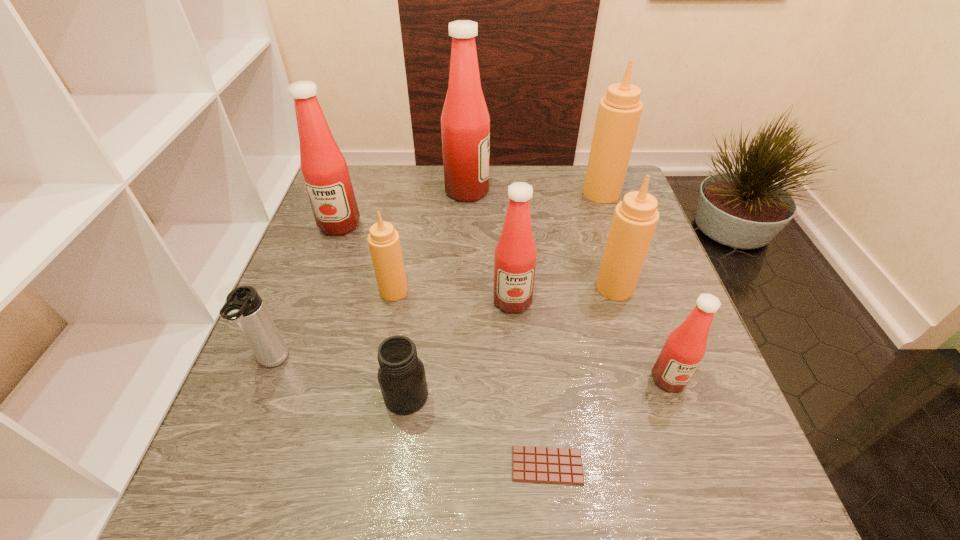
Locate an element on the screen. The image size is (960, 540). red condiment that is the second closest to the second biggest tan condiment is located at coordinates [x=685, y=346].

Select which tan condiment is the closest to the shortest object. Please provide its 2D coordinates. Your answer should be formatted as a tuple, i.e. [(x, y)], where the tuple contains the x and y coordinates of a point satisfying the conditions above.

[(635, 218)]

Point out which tan condiment is positioned as the second nearest to the brown candy bar. Please provide its 2D coordinates. Your answer should be formatted as a tuple, i.e. [(x, y)], where the tuple contains the x and y coordinates of a point satisfying the conditions above.

[(384, 244)]

Where is `vacant position in the image that satisfies the following two spatial constraints: 1. on the front-facing side of the biggest red condiment; 2. on the front side of the leftmost tan condiment`? vacant position in the image that satisfies the following two spatial constraints: 1. on the front-facing side of the biggest red condiment; 2. on the front side of the leftmost tan condiment is located at coordinates (464, 291).

Identify the location of blank area in the image that satisfies the following two spatial constraints: 1. on the handle side of the thermos bottle; 2. on the right side of the jar. (259, 396).